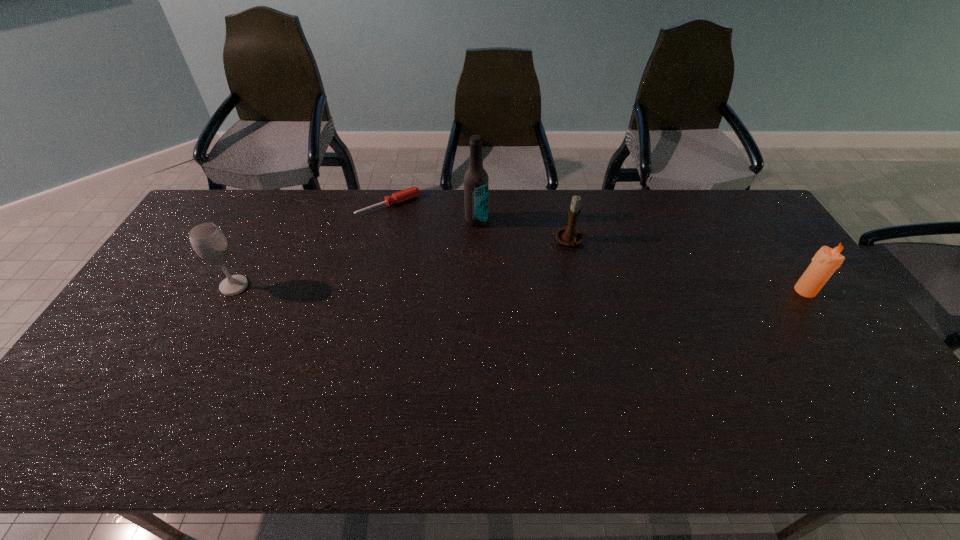
Where is `vacant space on the desktop that is between the wineglass and the rightmost object and is positioned on the label of the third object from left to right`? This screenshot has width=960, height=540. vacant space on the desktop that is between the wineglass and the rightmost object and is positioned on the label of the third object from left to right is located at coordinates (468, 288).

The width and height of the screenshot is (960, 540). I want to click on vacant space on the desktop that is between the wineglass and the rightmost object and is positioned on the side of the fourth object from left to right with the handle, so click(573, 289).

Locate an element on the screen. vacant space on the desktop that is between the leftmost object and the candle and is positioned at the tip of the screwdriver is located at coordinates (457, 288).